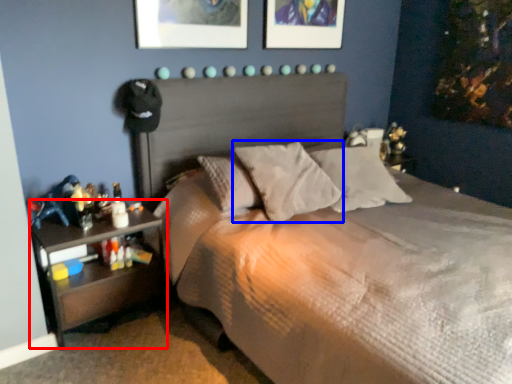
Question: Which of the following is the closest to the observer, nightstand (highlighted by a red box) or pillow (highlighted by a blue box)?

Choices:
 (A) nightstand
 (B) pillow

Answer: (A)